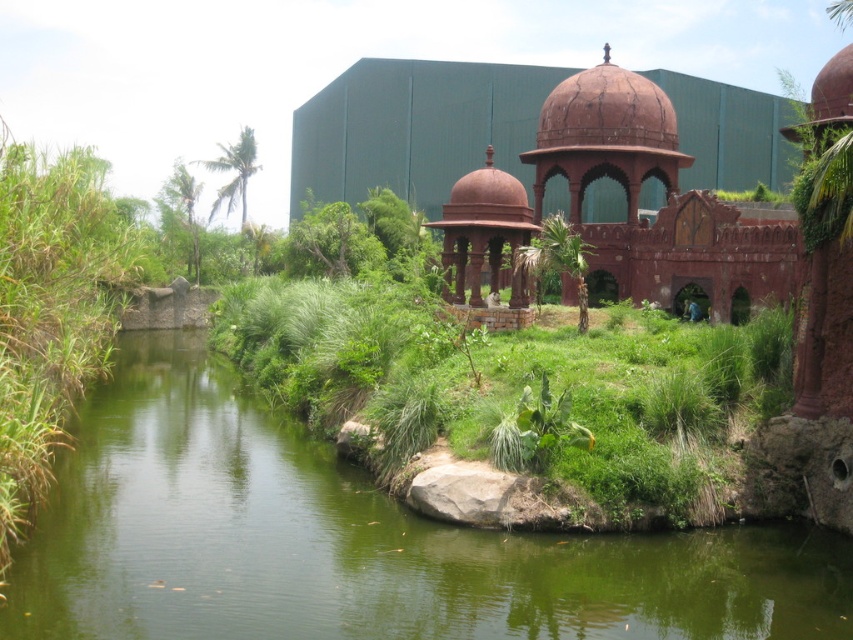
Can you confirm if green grassy stream at center is positioned above rustic terracotta gazebo at center?

No, green grassy stream at center is not above rustic terracotta gazebo at center.

Measure the distance between point (590, 556) and camera.

Point (590, 556) and camera are 32.02 meters apart from each other.

The image size is (853, 640). Find the location of `green grassy stream at center`. green grassy stream at center is located at coordinates (354, 540).

Can you confirm if green grassy stream at center is smaller than rustic stone gazebo at center?

Incorrect, green grassy stream at center is not smaller in size than rustic stone gazebo at center.

Can you confirm if green grassy stream at center is bigger than rustic stone gazebo at center?

Indeed, green grassy stream at center has a larger size compared to rustic stone gazebo at center.

Measure the distance between point (608, 572) and camera.

A distance of 30.86 meters exists between point (608, 572) and camera.

The height and width of the screenshot is (640, 853). Find the location of `green grassy stream at center`. green grassy stream at center is located at coordinates (354, 540).

Can you confirm if rustic terracotta gazebo at center is wider than rustic stone gazebo at center?

Correct, the width of rustic terracotta gazebo at center exceeds that of rustic stone gazebo at center.

Who is higher up, rustic terracotta gazebo at center or rustic stone gazebo at center?

rustic terracotta gazebo at center is above.

Where is `rustic terracotta gazebo at center`? The height and width of the screenshot is (640, 853). rustic terracotta gazebo at center is located at coordinates (625, 198).